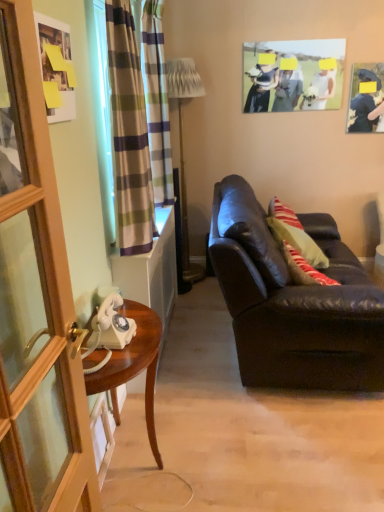
Question: Can we say metallic gold floor lamp at center lies outside matte paper photo frame at upper center, positioned as the third picture frame in bottom-to-top order?

Choices:
 (A) no
 (B) yes

Answer: (B)

Question: Is metallic gold floor lamp at center smaller than matte paper photo frame at upper center, which ranks as the 2th picture frame in right-to-left order?

Choices:
 (A) no
 (B) yes

Answer: (A)

Question: Could matte paper photo frame at upper center, which ranks as the 2th picture frame in right-to-left order, be considered to be inside metallic gold floor lamp at center?

Choices:
 (A) no
 (B) yes

Answer: (A)

Question: From the image's perspective, would you say metallic gold floor lamp at center is shown under matte paper photo frame at upper center, which ranks as the 2th picture frame in right-to-left order?

Choices:
 (A) no
 (B) yes

Answer: (B)

Question: Is metallic gold floor lamp at center at the left side of matte paper photo frame at upper center, which ranks as the 2th picture frame in right-to-left order?

Choices:
 (A) no
 (B) yes

Answer: (B)

Question: Is metallic gold floor lamp at center facing towards matte paper photo frame at upper center, the 2th picture frame positioned from the back?

Choices:
 (A) yes
 (B) no

Answer: (A)

Question: Is wooden screen door at left at the left side of matte paper photo frame at upper center, which is the second picture frame from front to back?

Choices:
 (A) yes
 (B) no

Answer: (A)

Question: Is wooden screen door at left next to matte paper photo frame at upper center, placed as the second picture frame when sorted from left to right?

Choices:
 (A) no
 (B) yes

Answer: (A)

Question: From the image's perspective, is wooden screen door at left located above matte paper photo frame at upper center, positioned as the third picture frame in bottom-to-top order?

Choices:
 (A) yes
 (B) no

Answer: (B)

Question: Could matte paper photo frame at upper center, the first picture frame from the top, be considered to be inside wooden screen door at left?

Choices:
 (A) yes
 (B) no

Answer: (B)

Question: Does wooden screen door at left have a lesser width compared to matte paper photo frame at upper center, the first picture frame from the top?

Choices:
 (A) yes
 (B) no

Answer: (B)

Question: From the image's perspective, is wooden screen door at left under matte paper photo frame at upper center, positioned as the third picture frame in bottom-to-top order?

Choices:
 (A) yes
 (B) no

Answer: (A)

Question: Can you confirm if plaid fabric curtain at left, acting as the 2th curtain starting from the back, is positioned to the left of matte black couch at right?

Choices:
 (A) yes
 (B) no

Answer: (A)